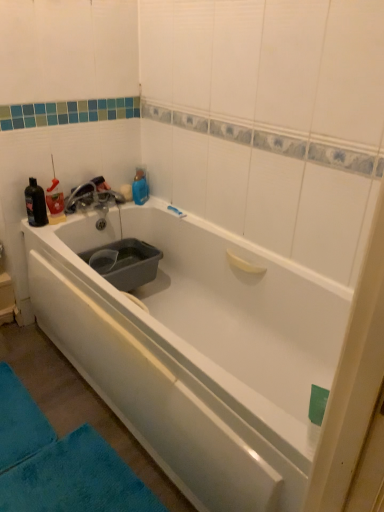
Image resolution: width=384 pixels, height=512 pixels. What are the coordinates of `vacant area on top of blue soft bath mat at lower left, which is counted as the first bath mat, starting from the left (from a real-world perspective)` in the screenshot? It's located at (14, 410).